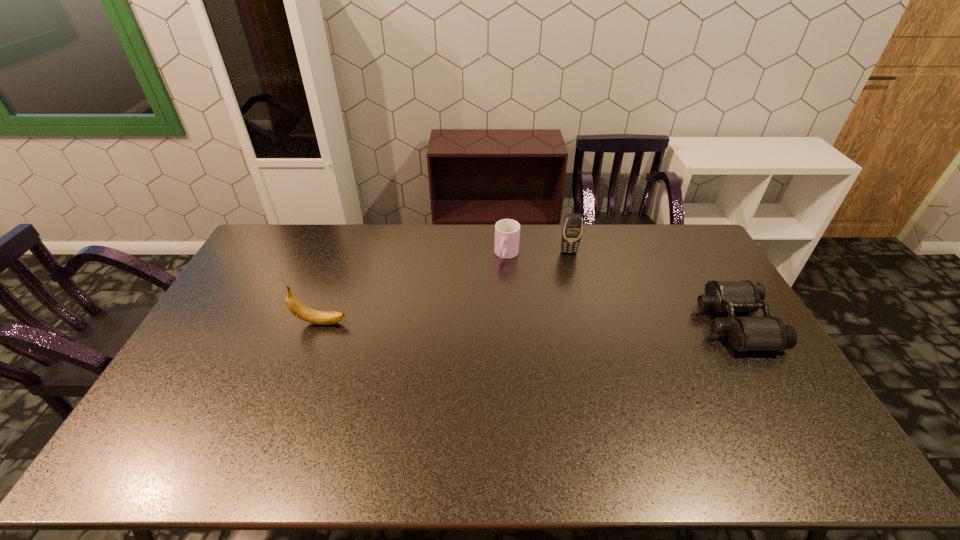
Identify the location of empty space that is in between the third object from left to right and the rightmost object. The height and width of the screenshot is (540, 960). (652, 288).

Locate an element on the screen. The image size is (960, 540). free point between the second object from left to right and the rightmost object is located at coordinates (621, 289).

Find the location of a particular element. free space that is in between the cup and the rightmost object is located at coordinates (621, 289).

Locate an element on the screen. The width and height of the screenshot is (960, 540). vacant space that is in between the binoculars and the leftmost object is located at coordinates (528, 323).

Identify the location of free space between the leftmost object and the shortest object. The height and width of the screenshot is (540, 960). (528, 323).

Find the location of a particular element. The width and height of the screenshot is (960, 540). object that stands as the third closest to the rightmost object is located at coordinates (300, 311).

You are a GUI agent. You are given a task and a screenshot of the screen. Output one action in this format:
    pyautogui.click(x=<x>, y=<y>)
    Task: Click on the object that stands as the second closest to the third tallest object
    
    Given the screenshot: What is the action you would take?
    pyautogui.click(x=300, y=311)

Find the location of a particular element. This screenshot has height=540, width=960. blank area in the image that satisfies the following two spatial constraints: 1. on the front side of the rightmost object; 2. through the eyepieces of the cup is located at coordinates (512, 323).